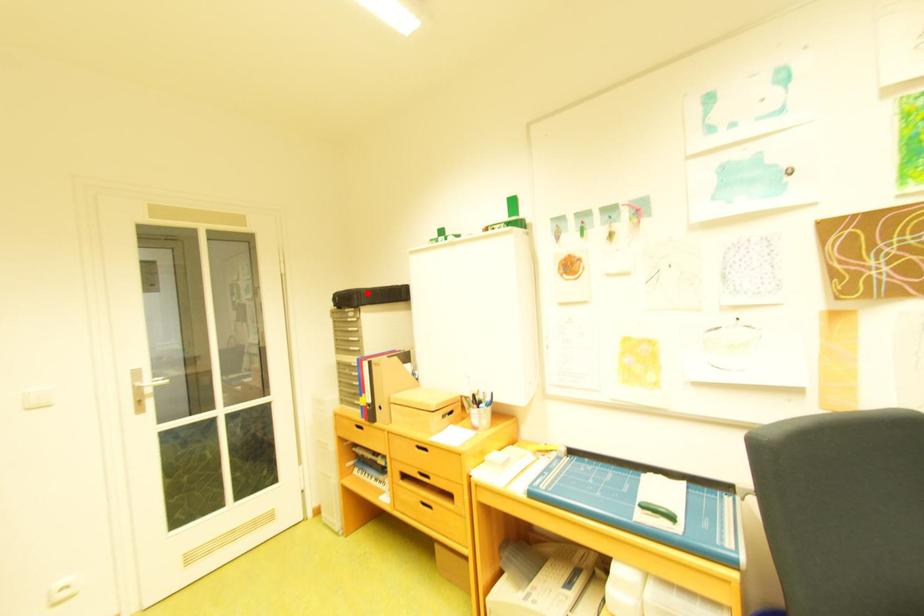
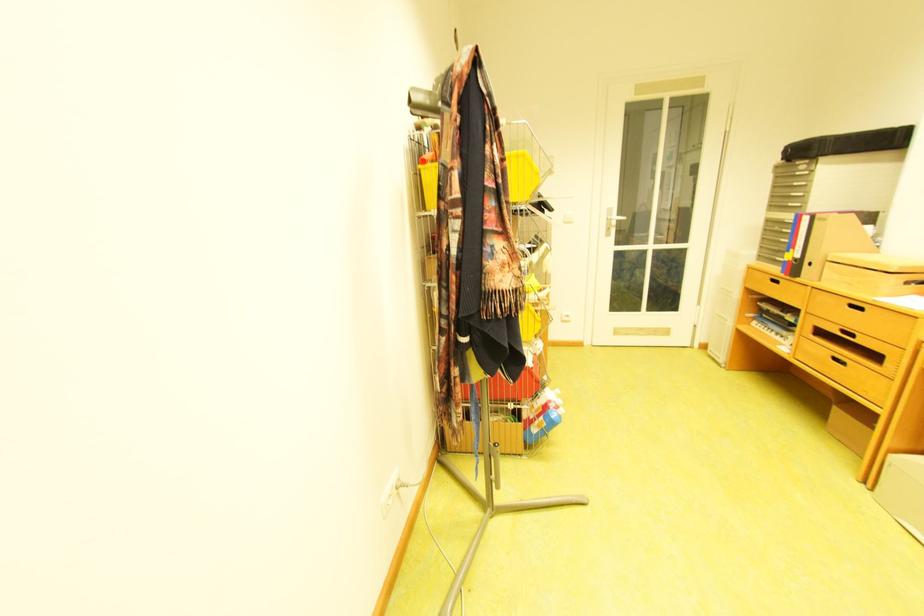
Find the pixel in the second image that matches the highlighted location in the first image.

(832, 140)